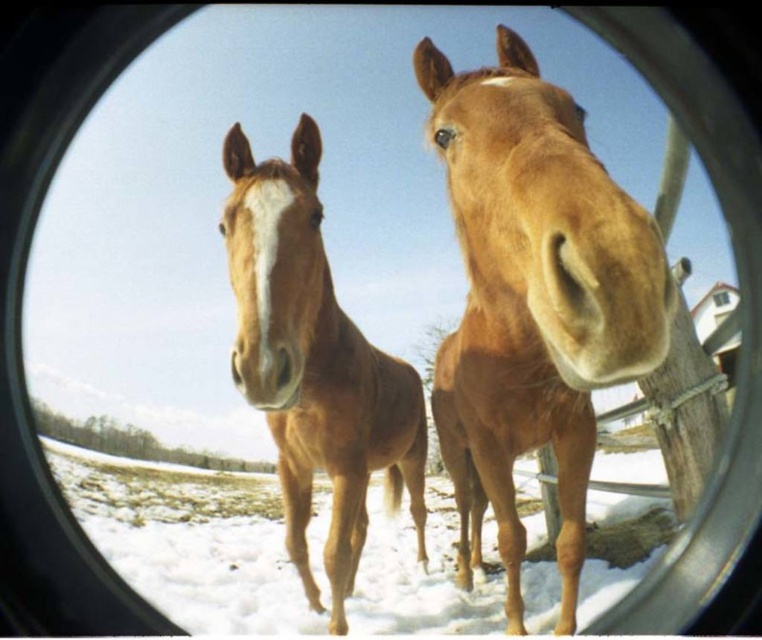
You are an artist trying to sketch the two horses through the circular lens. Which horse, the brown matte horse at center or the brown glossy horse at center, would you need to draw smaller to maintain their relative sizes as seen through the lens?

The brown matte horse at center is not as tall as the brown glossy horse at center, so to maintain their relative sizes, you should draw the brown matte horse at center smaller than the brown glossy horse at center.

You are an artist trying to sketch the two horses seen through the circular lens. Which horse, the brown matte horse at center or the brown glossy horse at center, is positioned higher in the image?

The brown matte horse at center is positioned higher in the image as it is above the brown glossy horse at center.

You are an astronaut on a space mission and need to determine which of the two points, point (476,140) or point (277,250), is closer to your current position. Based on the image of the two horses through the circular lens, which point should you choose?

Point (476,140) is closer to the viewer than point (277,250), so you should choose point (476,140).